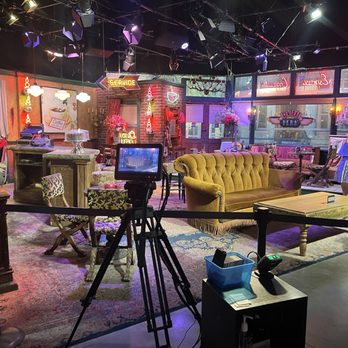
Locate an element on the screen. back of couch is located at coordinates (211, 159), (231, 158).